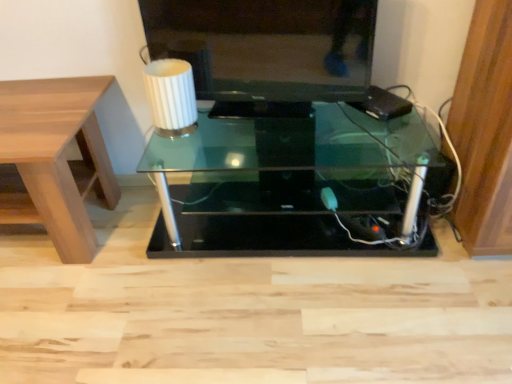
The width and height of the screenshot is (512, 384). In order to click on free space above light brown wood table at left, the second table viewed from the right (from a real-world perspective) in this screenshot , I will do `click(34, 104)`.